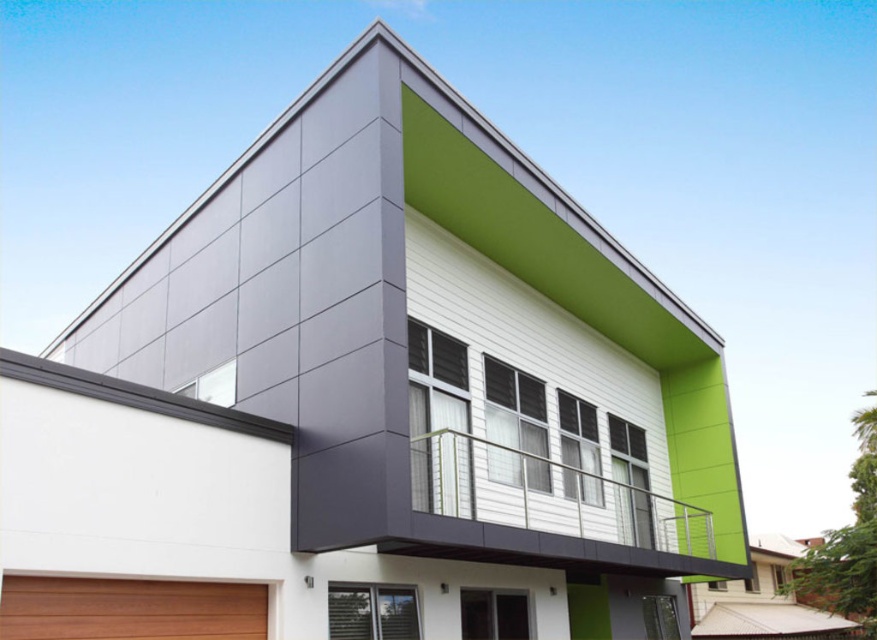
You are a drone operator tasked with capturing aerial footage of the metallic silver balcony at upper center. Your drone has a maximum flight range of 6 meters. Based on the scene, can your drone safely reach the balcony without exceeding its range limit?

The distance between the metallic silver balcony at upper center and the camera is 6.36 meters. Since the drone can only fly up to 6 meters, it cannot safely reach the balcony without exceeding its range limit.

You are a delivery drone with a wingspan of 3.5 feet. You need to fly from the brown wood at lower left to the metallic silver balcony at upper center. Is there enough space between them for your drone to pass through?

The distance between the metallic silver balcony at upper center and the brown wood at lower left is 14.60 feet. Since your drone has a wingspan of 3.5 feet, there is sufficient space for it to pass through safely.

You are an architect planning to install a new railing on the metallic silver balcony at upper center and the brown wood at lower left. Which object requires a wider railing installation based on their widths?

The metallic silver balcony at upper center requires a wider railing installation because its width surpasses that of the brown wood at lower left.